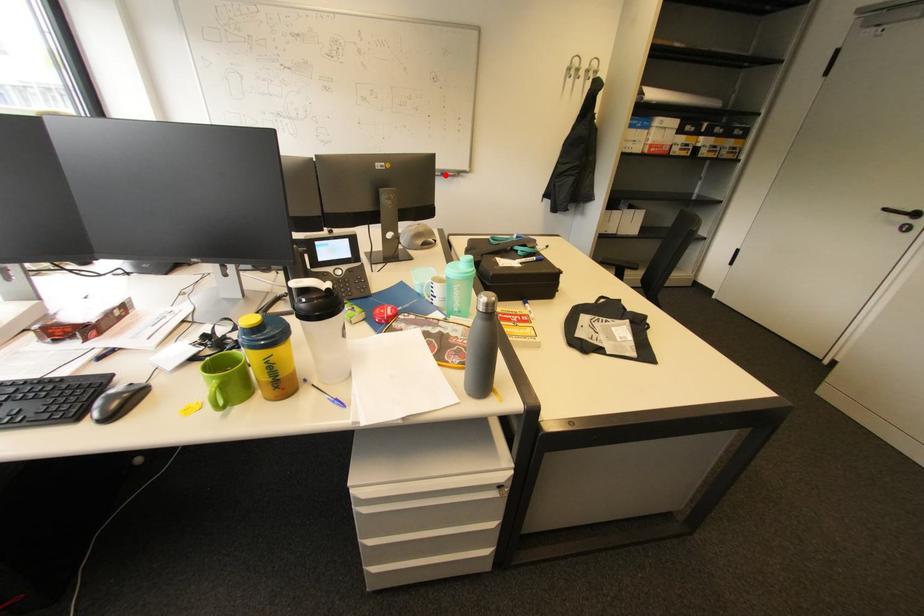
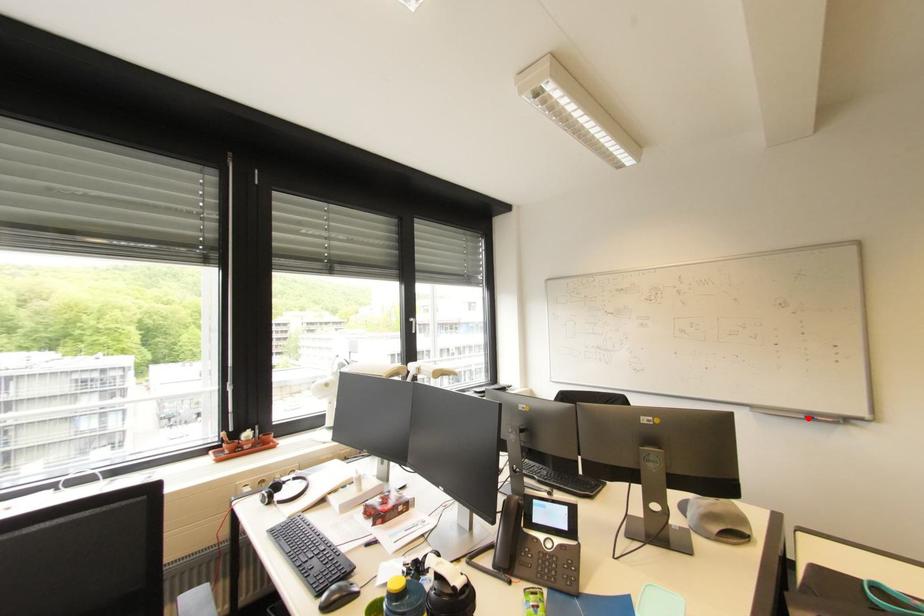
I am providing you with two images of the same scene from different viewpoints. A red point is marked on the first image and another point is marked on the second image. Do the highlighted points in image1 and image2 indicate the same real-world spot?

Yes